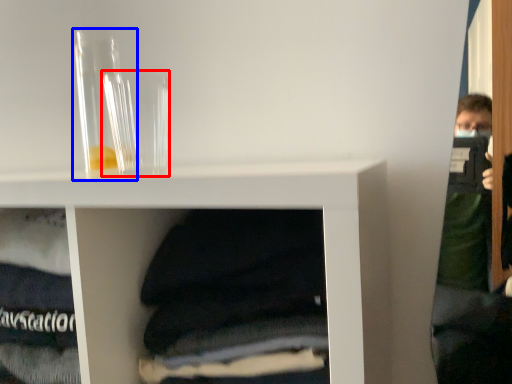
Question: Which object is closer to the camera taking this photo, glass vase (highlighted by a red box) or glass vase (highlighted by a blue box)?

Choices:
 (A) glass vase
 (B) glass vase

Answer: (A)